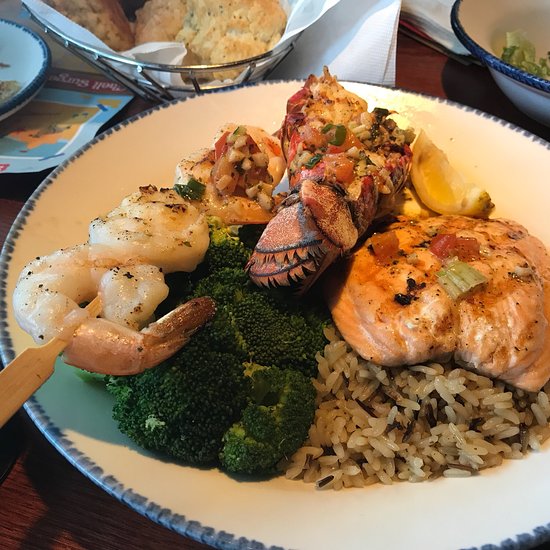
At what (x,y) coordinates should I click in order to perform the action: click on bowl. Please return your answer as a coordinate pair (x, y). The width and height of the screenshot is (550, 550). Looking at the image, I should click on (491, 59).